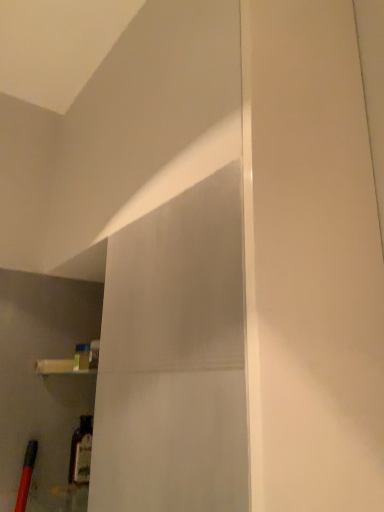
Measure the distance between point (73,480) and camera.

Point (73,480) and camera are 4.05 feet apart from each other.

In order to face translucent glass bottle at lower left, should I rotate leftwards or rightwards?

You should rotate left by 14.770 degrees.

What do you see at coordinates (81, 452) in the screenshot?
I see `translucent glass bottle at lower left` at bounding box center [81, 452].

The image size is (384, 512). I want to click on translucent glass bottle at lower left, so click(x=81, y=452).

Locate an element on the screen. translucent glass bottle at lower left is located at coordinates (81, 452).